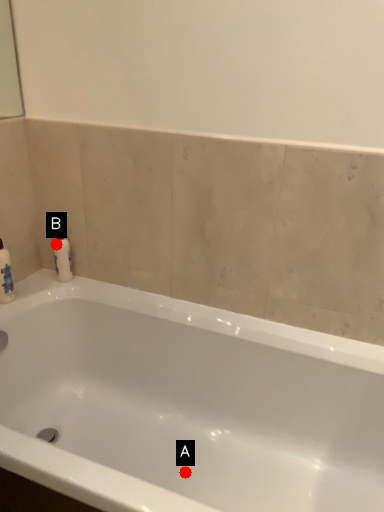
Question: Two points are circled on the image, labeled by A and B beside each circle. Which of the following is the closest to the observer?

Choices:
 (A) A is closer
 (B) B is closer

Answer: (A)